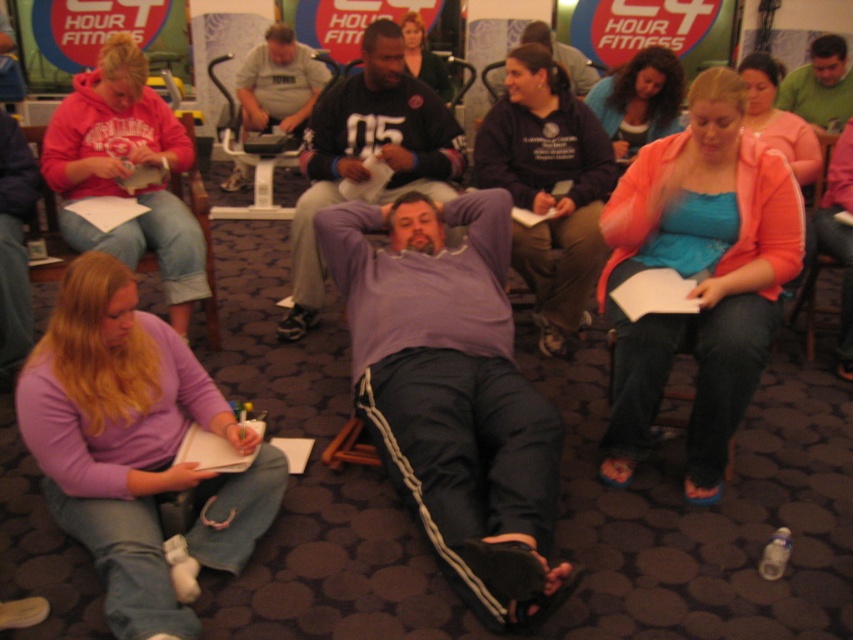
You are standing in the fitness class and want to place a small mat between the two points labeled point (x=500, y=257) and point (x=183, y=294). Which point should the mat be closer to in order to be nearer to the camera?

The mat should be placed closer to point (x=500, y=257) because it is closer to the camera than point (x=183, y=294).

Based on the coordinates provided, where is the purple cotton shirt at center located in the image?

The purple cotton shirt at center is located at point coordinates of 0.606 on the x axis and 0.529 on the y axis.